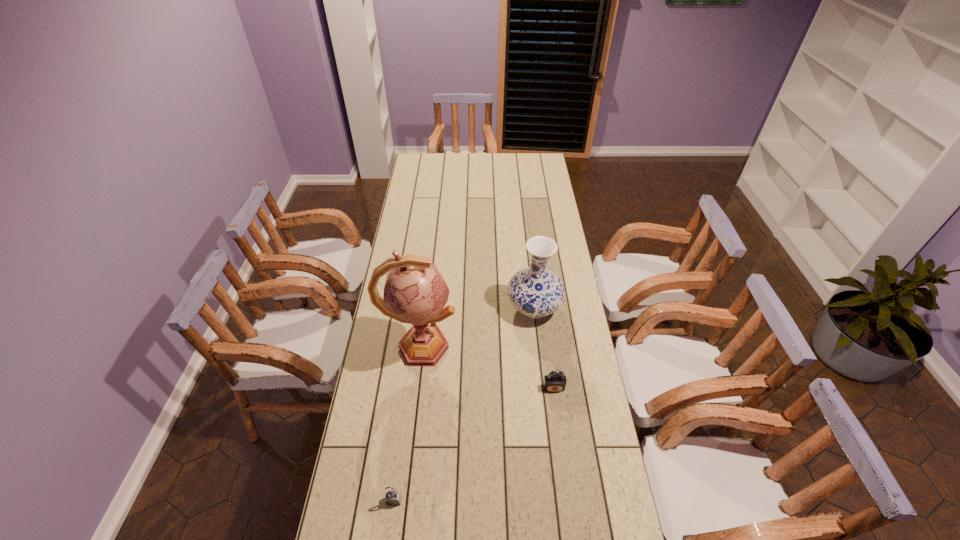
Locate an element on the screen. The height and width of the screenshot is (540, 960). globe that is at the left edge is located at coordinates (415, 292).

Locate an element on the screen. padlock that is at the left edge is located at coordinates (393, 498).

Where is `vase at the right edge`? vase at the right edge is located at coordinates (535, 291).

Locate an element on the screen. The height and width of the screenshot is (540, 960). padlock that is at the right edge is located at coordinates (555, 381).

Where is `vacant space at the far edge of the desktop`? vacant space at the far edge of the desktop is located at coordinates (468, 156).

I want to click on free space at the left edge, so click(x=390, y=331).

Locate an element on the screen. The width and height of the screenshot is (960, 540). vacant space at the right edge of the desktop is located at coordinates (587, 457).

In the image, there is a desktop. Find the location of `vacant space at the far left corner`. vacant space at the far left corner is located at coordinates (423, 169).

Locate an element on the screen. The width and height of the screenshot is (960, 540). unoccupied area between the tallest object and the left padlock is located at coordinates (407, 424).

Where is `free space that is in between the globe and the nearest object`? The image size is (960, 540). free space that is in between the globe and the nearest object is located at coordinates (407, 424).